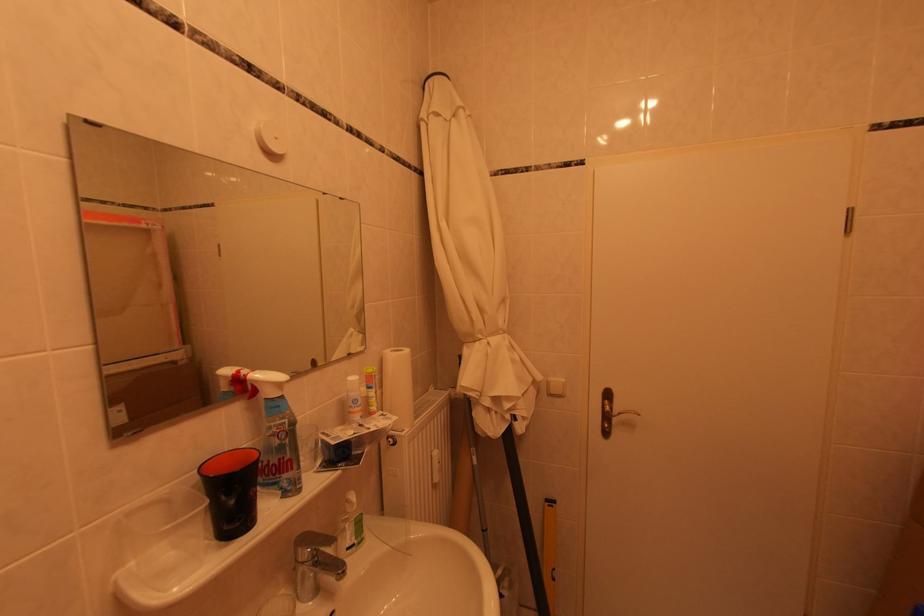
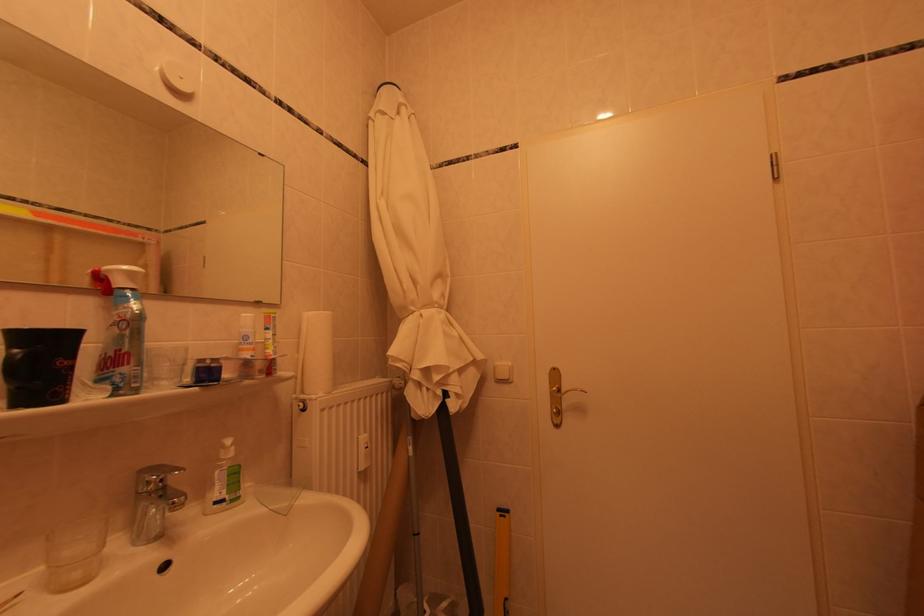
Where in the second image is the point corresponding to point (523, 427) from the first image?

(456, 405)